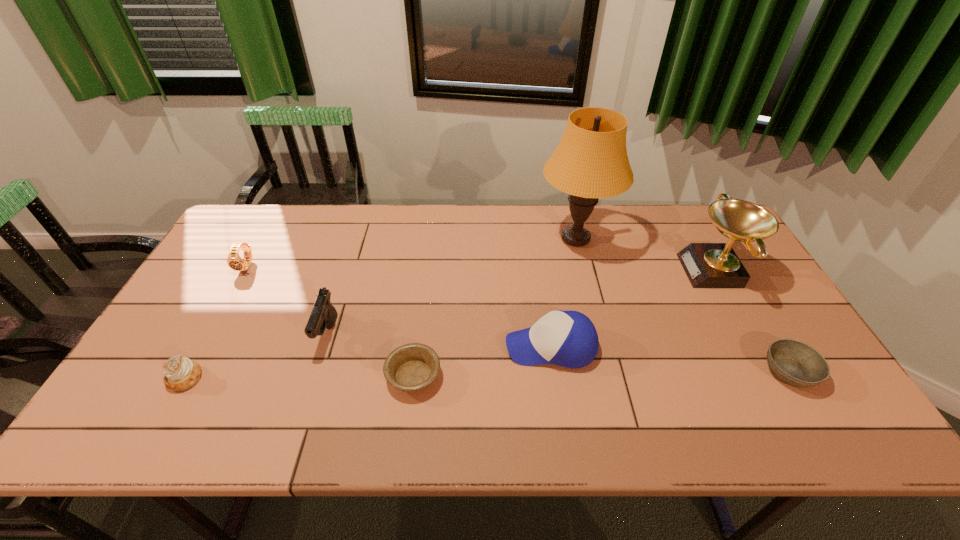
In order to click on lampshade in this screenshot , I will do `click(590, 162)`.

What are the coordinates of `award` in the screenshot? It's located at (707, 265).

The height and width of the screenshot is (540, 960). Identify the location of the third object from left to right. (323, 315).

Identify the location of the fifth shortest object. (569, 339).

The width and height of the screenshot is (960, 540). Find the location of `the fifth tallest object`. the fifth tallest object is located at coordinates (235, 262).

This screenshot has height=540, width=960. What are the coordinates of `the sixth tallest object` in the screenshot? It's located at (181, 373).

Image resolution: width=960 pixels, height=540 pixels. What are the coordinates of `the right bowl` in the screenshot? It's located at (796, 363).

This screenshot has width=960, height=540. In order to click on the fifth object from right to left in this screenshot , I will do `click(412, 367)`.

Where is `the left bowl`? The width and height of the screenshot is (960, 540). the left bowl is located at coordinates (412, 367).

At what (x,y) coordinates should I click in order to perform the action: click on free spot located 0.140m on the left of the lampshade. Please return your answer as a coordinate pair (x, y). The width and height of the screenshot is (960, 540). Looking at the image, I should click on [x=493, y=239].